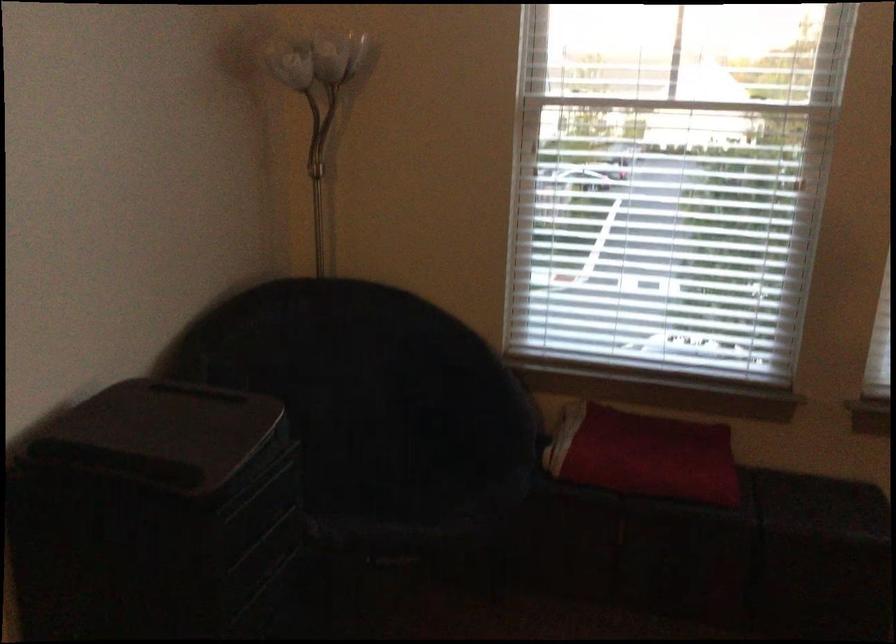
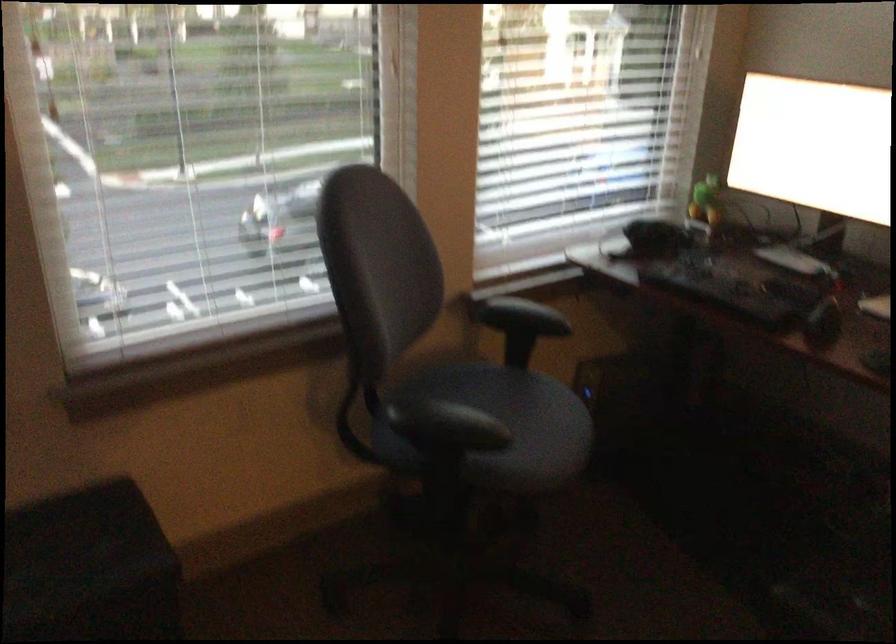
Question: The camera is either moving clockwise (left) or counter-clockwise (right) around the object. The first image is from the beginning of the video and the second image is from the end. Is the camera moving left or right when shooting the video?

Choices:
 (A) Left
 (B) Right

Answer: (A)